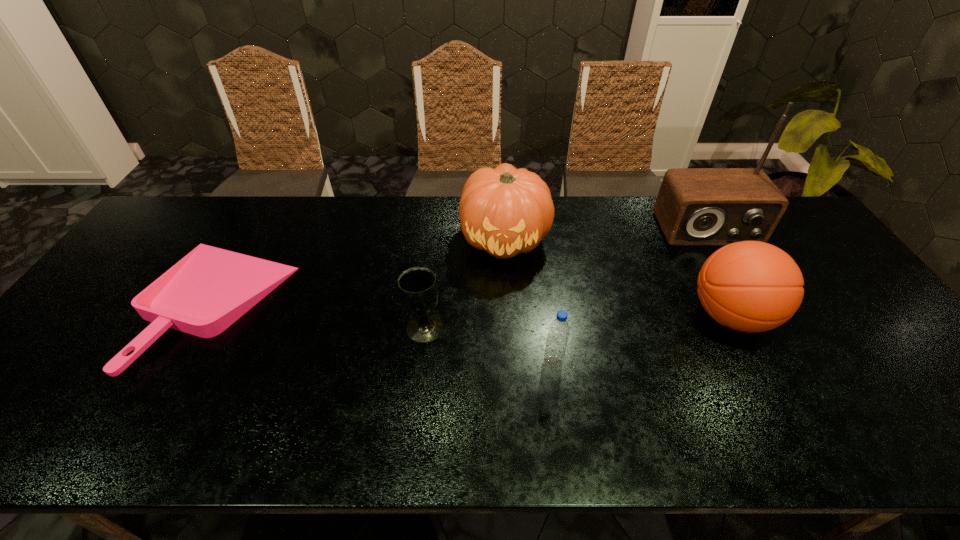
The height and width of the screenshot is (540, 960). Find the location of `the tallest object`. the tallest object is located at coordinates (695, 206).

The height and width of the screenshot is (540, 960). What are the coordinates of `pumpkin` in the screenshot? It's located at (505, 211).

The image size is (960, 540). Find the location of `basketball`. basketball is located at coordinates (750, 286).

Identify the location of water bottle. Image resolution: width=960 pixels, height=540 pixels. (559, 330).

Where is `chalice`? This screenshot has width=960, height=540. chalice is located at coordinates (x=418, y=290).

In order to click on the shortest object in this screenshot , I will do `click(210, 288)`.

Find the location of a particular element. the leftmost object is located at coordinates (210, 288).

The image size is (960, 540). In order to click on vacant space located 0.260m on the front-facing side of the radio receiver in this screenshot , I will do `click(756, 314)`.

I want to click on free space located 0.130m on the carved face of the pumpkin, so click(x=509, y=305).

Identify the location of free space located 0.060m on the right of the basketball. This screenshot has height=540, width=960. (796, 316).